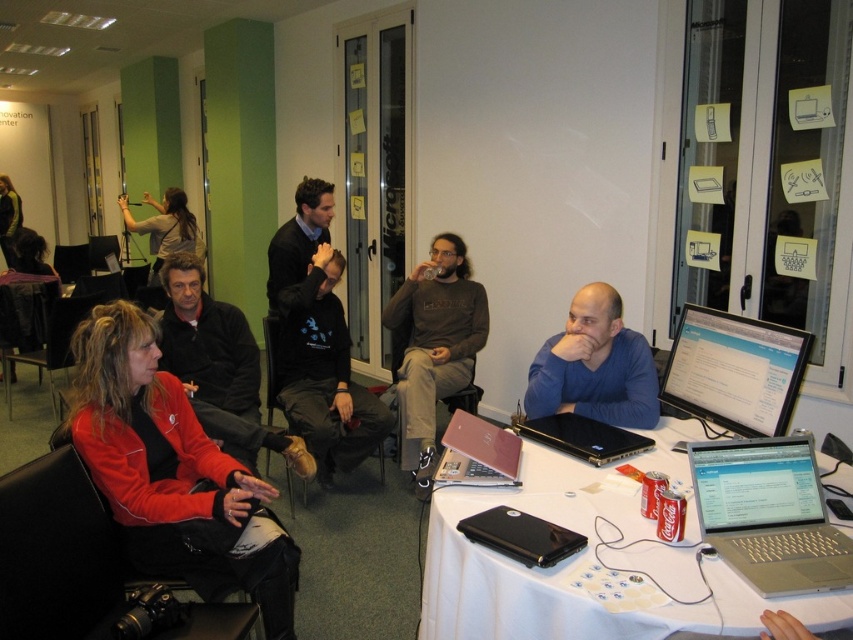
Question: From the image, what is the correct spatial relationship of white cloth-covered table at lower right in relation to black cotton shirt at center?

Choices:
 (A) right
 (B) left

Answer: (A)

Question: Is white cloth-covered table at lower right smaller than red fleece jacket at center?

Choices:
 (A) no
 (B) yes

Answer: (A)

Question: Among these points, which one is farthest from the camera?

Choices:
 (A) (757, 522)
 (B) (309, 321)
 (C) (633, 358)
 (D) (462, 595)

Answer: (B)

Question: Is white cloth-covered table at lower right wider than silver glossy monitor at center right?

Choices:
 (A) yes
 (B) no

Answer: (A)

Question: Which object appears closest to the camera in this image?

Choices:
 (A) pink matte laptop at center
 (B) black matte laptop at lower center
 (C) red fleece jacket at center

Answer: (B)

Question: Which of the following is the farthest from the observer?

Choices:
 (A) (575, 380)
 (B) (218, 353)
 (C) (196, 429)

Answer: (B)